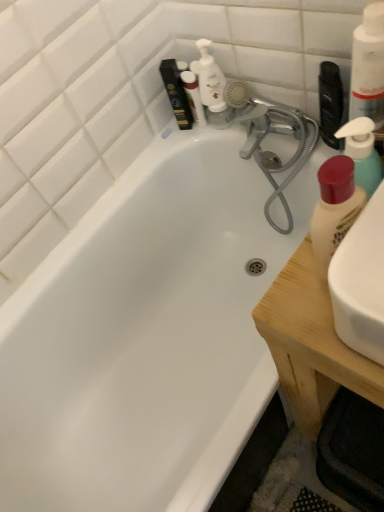
Question: Relative to matte white lotion at right, which appears as the first cleaning product when ordered from the bottom, is wooden at right in front or behind?

Choices:
 (A) front
 (B) behind

Answer: (B)

Question: Looking at the image, does wooden at right seem bigger or smaller compared to matte white lotion at right, which appears as the first cleaning product when ordered from the bottom?

Choices:
 (A) big
 (B) small

Answer: (A)

Question: Considering the real-world distances, which object is closest to the wooden at right?

Choices:
 (A) white pump bottle at upper right, which is the first cleaning product from top to bottom
 (B) matte white lotion at right, which is the third cleaning product from top to bottom
 (C) white plastic pump bottle at upper center
 (D) translucent plastic pump bottle at right, marked as the second cleaning product in a top-to-bottom arrangement

Answer: (B)

Question: Which of these objects is positioned farthest from the translucent plastic pump bottle at right, which is counted as the 2th cleaning product, starting from the bottom?

Choices:
 (A) white pump bottle at upper right, the 3th cleaning product from the bottom
 (B) wooden at right
 (C) white plastic pump bottle at upper center
 (D) matte white lotion at right, which is the third cleaning product from top to bottom

Answer: (C)